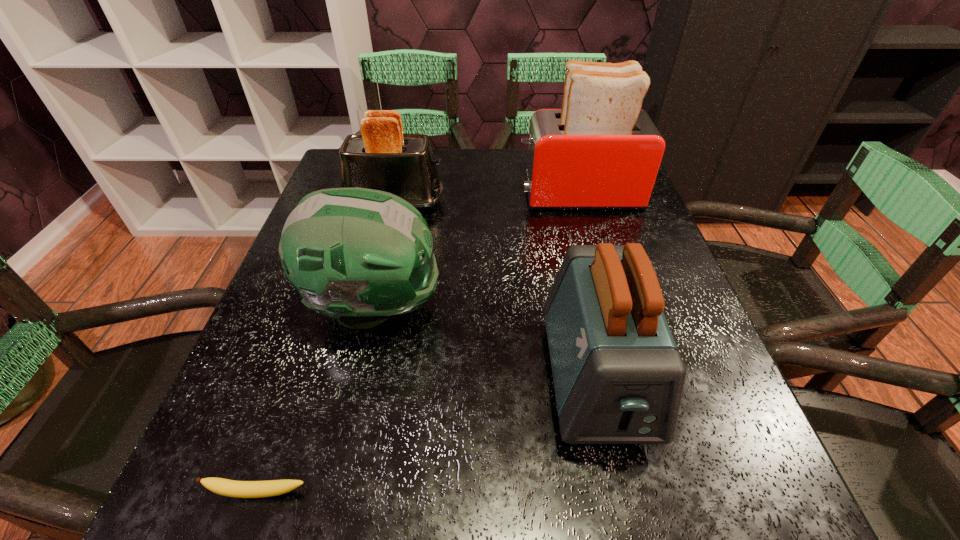
The width and height of the screenshot is (960, 540). What are the coordinates of `vacant space at the left edge` in the screenshot? It's located at (276, 311).

Locate an element on the screen. The width and height of the screenshot is (960, 540). vacant space at the right edge of the desktop is located at coordinates (676, 273).

Where is `vacant region at the near left corner of the desktop`? The width and height of the screenshot is (960, 540). vacant region at the near left corner of the desktop is located at coordinates (306, 479).

What are the coordinates of `vacant area that lies between the leftmost toaster and the nearest toaster` in the screenshot? It's located at (495, 291).

Image resolution: width=960 pixels, height=540 pixels. In order to click on empty space that is in between the tallest toaster and the nearest object in this screenshot , I will do `click(420, 344)`.

Where is `free point between the leftmost toaster and the nearest toaster`? The height and width of the screenshot is (540, 960). free point between the leftmost toaster and the nearest toaster is located at coordinates (495, 291).

Find the location of `vacant area between the leftmost toaster and the tallest object`. vacant area between the leftmost toaster and the tallest object is located at coordinates (487, 199).

The height and width of the screenshot is (540, 960). Identify the location of unoccupied position between the nearest toaster and the leftmost toaster. (495, 291).

In order to click on vacant area that lies between the football helmet and the tallest object in this screenshot , I will do `click(477, 251)`.

Identify the location of vacant point located between the leftmost toaster and the banana. The width and height of the screenshot is (960, 540). (327, 348).